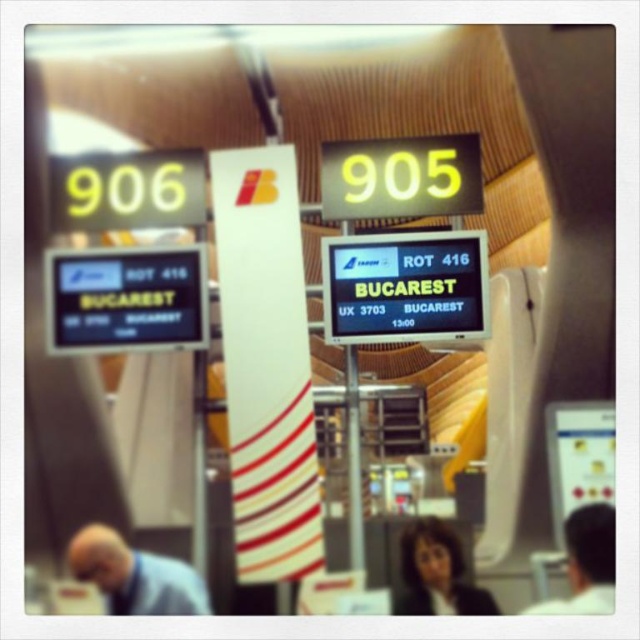
You are a passenger at the airport looking for your gate. You see a person wearing a light blue shirt at lower left and another with dark hair at right. Which person is closer to the departure gates 905 and 906?

The light blue shirt at lower left is positioned under dark hair at right, meaning they are closer to the departure gates 905 and 906.

You are a traveler standing in the airport terminal and notice two objects at the center of the scene. Which one is closer to you between the black lcd screen at center and the dark brown hair at center?

The black lcd screen at center is closer to you than the dark brown hair at center.

Looking at this image, you are standing in the airport terminal and want to locate the black lcd screen at center. According to the scene description, where would you find it?

The black lcd screen at center is located at the center of the scene, as indicated by its label. However, its precise 2D coordinates are at point (125, 300).